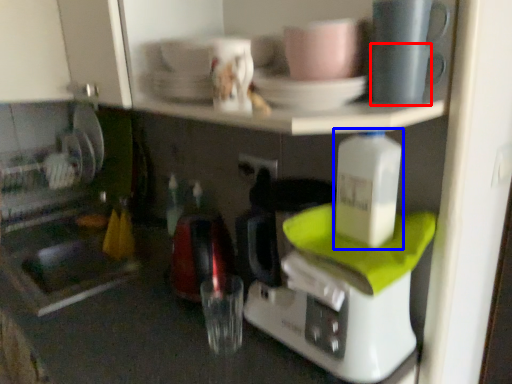
Question: Which of the following is the closest to the observer, tableware (highlighted by a red box) or bottle (highlighted by a blue box)?

Choices:
 (A) tableware
 (B) bottle

Answer: (A)